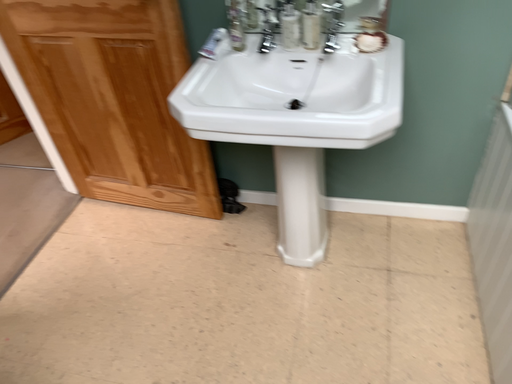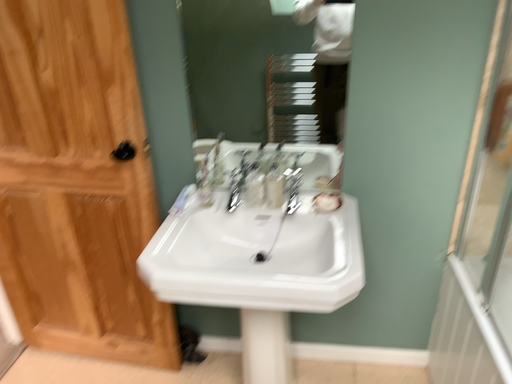
Question: How did the camera likely rotate when shooting the video?

Choices:
 (A) rotated downward
 (B) rotated upward

Answer: (B)